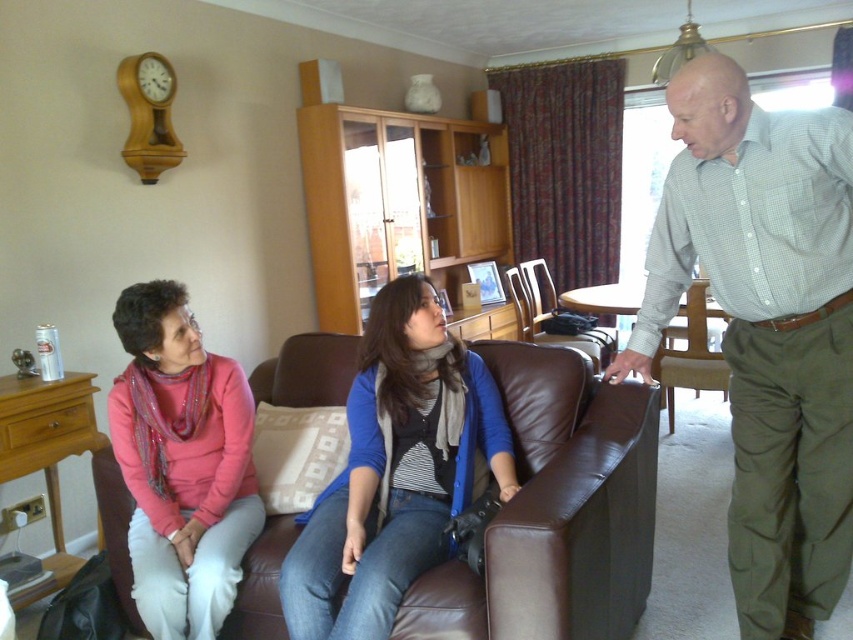
You are a guest in this living room and want to sit down. You see the green checkered shirt at right and the brown leather chair at right. Which object is closer to the floor?

The green checkered shirt at right is located below the brown leather chair at right, so it is closer to the floor than the brown leather chair at right.

You are a guest entering the living room and want to sit on the brown leather couch at center. However, you notice the blue knit sweater at center is on the couch. Can you sit there without moving the sweater?

The brown leather couch at center has a lesser height compared to blue knit sweater at center, meaning the sweater is placed higher up, possibly on a backrest or armrest. You can sit on the couch without moving the sweater as it might not be in your seating area.

Based on the photo, you are standing in the living room and want to move from the wall clock to the sofa. Which point, point (775, 172) or point (247, 388), is closer to the sofa?

Point (247, 388) is closer to the sofa because it is behind point (775, 172), which is in front of it.